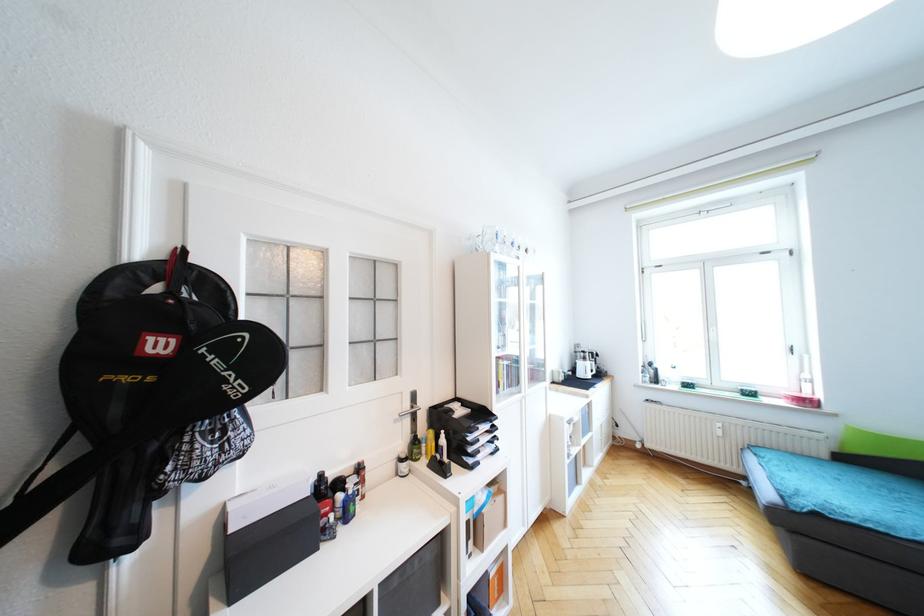
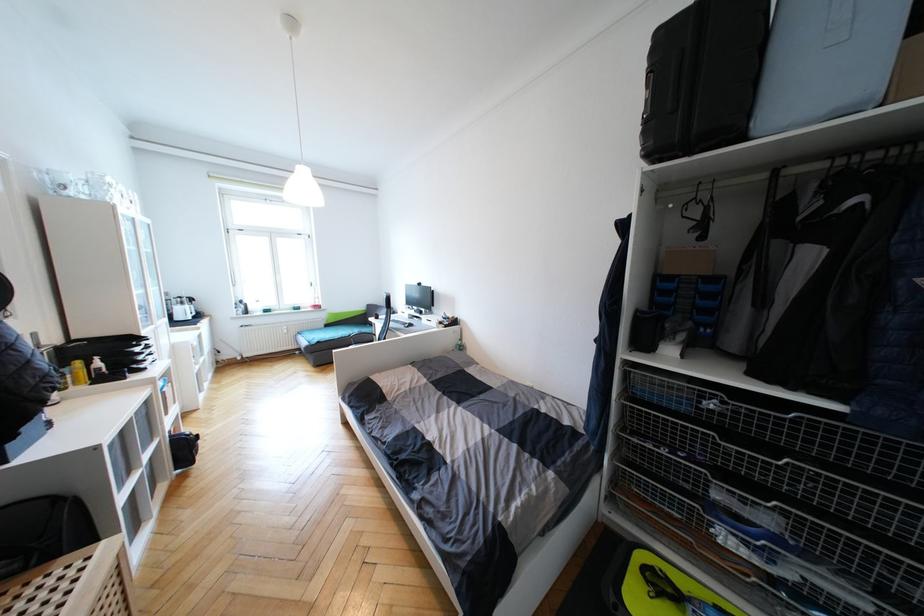
The point at [848,460] is marked in the first image. Where is the corresponding point in the second image?

(331, 326)